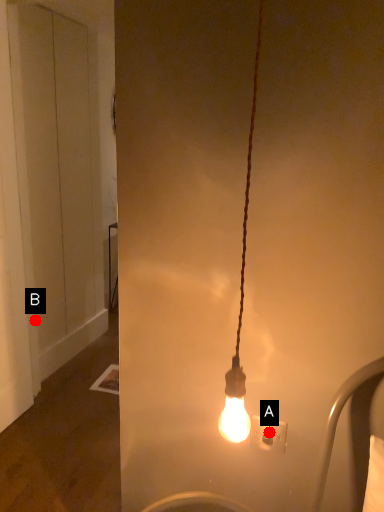
Question: Two points are circled on the image, labeled by A and B beside each circle. Which of the following is the closest to the observer?

Choices:
 (A) A is closer
 (B) B is closer

Answer: (A)